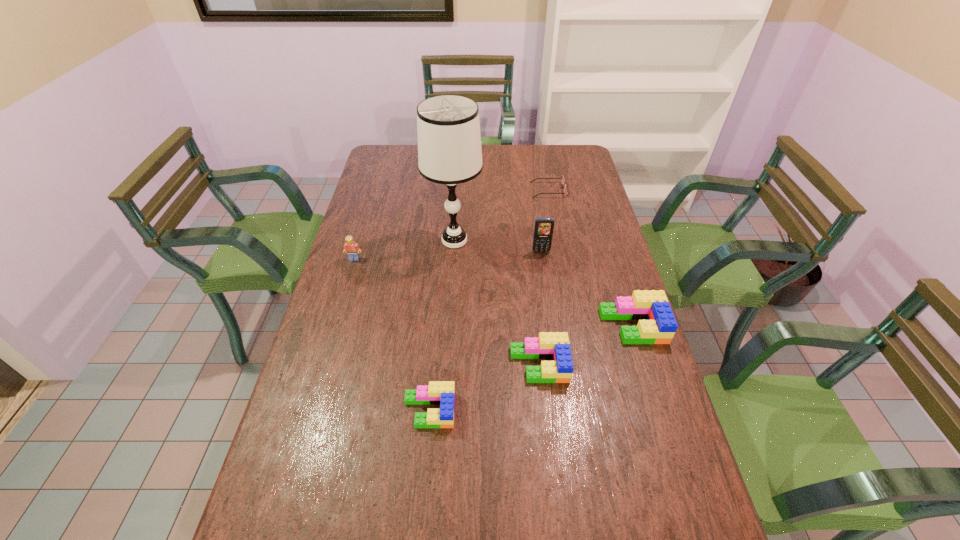
Select which Lego is the second closest to the third shortest object. Please provide its 2D coordinates. Your answer should be formatted as a tuple, i.e. [(x, y)], where the tuple contains the x and y coordinates of a point satisfying the conditions above.

[(437, 392)]

Find the location of a particular element. Lego that is the fourth closest one to the sunglasses is located at coordinates (437, 392).

Find the location of `free space that satisfies the following two spatial constraints: 1. on the screen of the fifth farthest object; 2. on the right side of the sixth shortest object`. free space that satisfies the following two spatial constraints: 1. on the screen of the fifth farthest object; 2. on the right side of the sixth shortest object is located at coordinates [552, 326].

Find the location of a particular element. The height and width of the screenshot is (540, 960). vacant space that satisfies the following two spatial constraints: 1. on the front-facing side of the third shortest object; 2. on the right side of the leftmost object is located at coordinates (323, 364).

The image size is (960, 540). What are the coordinates of `vacant position in the image that satisfies the following two spatial constraints: 1. on the front-facing side of the leftmost object; 2. on the right side of the third nearest object` in the screenshot? It's located at (334, 326).

Find the location of a particular element. vacant space that satisfies the following two spatial constraints: 1. on the bridge of the sunglasses; 2. on the front-facing side of the farthest Lego is located at coordinates coord(562,259).

Find the location of `free space that satisfies the following two spatial constraints: 1. on the front-facing side of the rightmost Lego; 2. on the left side of the leftmost Lego`. free space that satisfies the following two spatial constraints: 1. on the front-facing side of the rightmost Lego; 2. on the left side of the leftmost Lego is located at coordinates (334, 326).

I want to click on free spot that satisfies the following two spatial constraints: 1. on the bridge of the shortest object; 2. on the front-facing side of the farthest Lego, so click(x=562, y=259).

What are the coordinates of `blank space that satisfies the following two spatial constraints: 1. on the front-facing side of the second shortest Lego; 2. on the left side of the leftmost object` in the screenshot? It's located at (323, 364).

Image resolution: width=960 pixels, height=540 pixels. I want to click on free spot that satisfies the following two spatial constraints: 1. on the front side of the tallest object; 2. on the right side of the fifth tallest object, so click(446, 364).